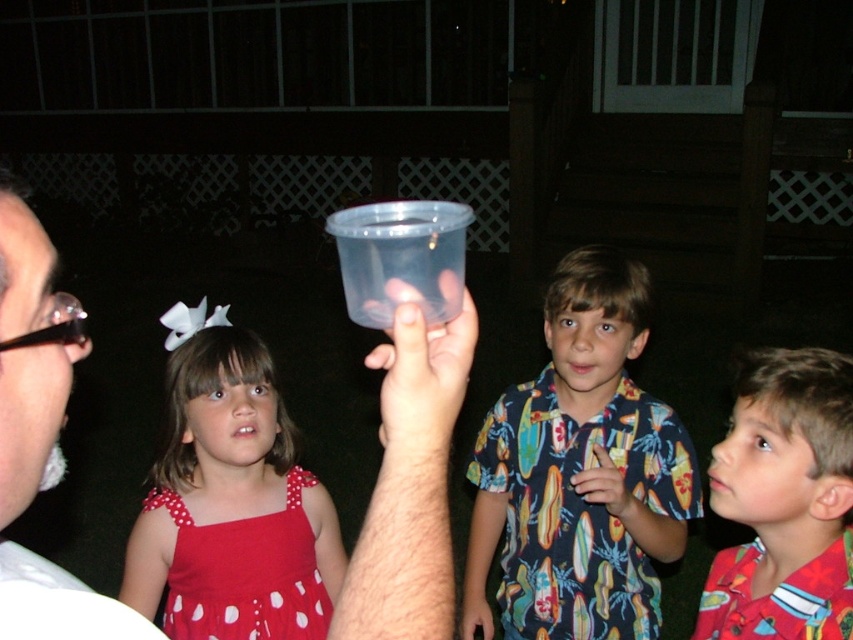
Question: Estimate the real-world distances between objects in this image. Which object is closer to the transparent plastic cup at center?

Choices:
 (A) printed fabric shirt at center
 (B) matte black sunglasses at upper left
 (C) red cotton shirt at center
 (D) matte red dress at left

Answer: (B)

Question: Can you confirm if printed fabric shirt at center is positioned below transparent plastic cup at center?

Choices:
 (A) yes
 (B) no

Answer: (A)

Question: Does matte red dress at left have a greater width compared to transparent plastic cup at center?

Choices:
 (A) yes
 (B) no

Answer: (A)

Question: Which point is farther to the camera?

Choices:
 (A) (381, 387)
 (B) (234, 492)
 (C) (727, 556)

Answer: (B)

Question: Which point is farther to the camera?

Choices:
 (A) printed fabric shirt at center
 (B) transparent plastic cup at center
 (C) red cotton shirt at center
 (D) matte black sunglasses at upper left

Answer: (A)

Question: Can you confirm if red cotton shirt at center is positioned below transparent plastic cup at center?

Choices:
 (A) yes
 (B) no

Answer: (A)